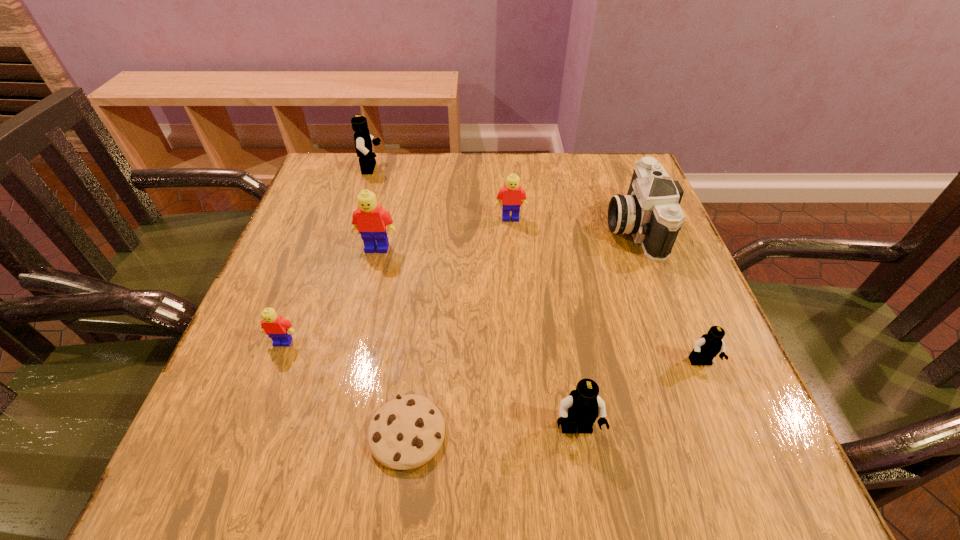
This screenshot has height=540, width=960. I want to click on yellow Lego that can be found as the second closest to the third farthest Lego, so click(x=278, y=329).

Where is `the second closest yellow Lego to the fourth nearest object`? the second closest yellow Lego to the fourth nearest object is located at coordinates [x=512, y=195].

The width and height of the screenshot is (960, 540). In order to click on free spot that satisfies the following two spatial constraints: 1. on the front-facing side of the cookie; 2. on the right side of the biggest black Lego in this screenshot , I will do `click(289, 434)`.

Identify the location of blank space that satisfies the following two spatial constraints: 1. on the front-facing side of the leftmost black Lego; 2. on the front-facing side of the leftmost Lego. This screenshot has width=960, height=540. (318, 342).